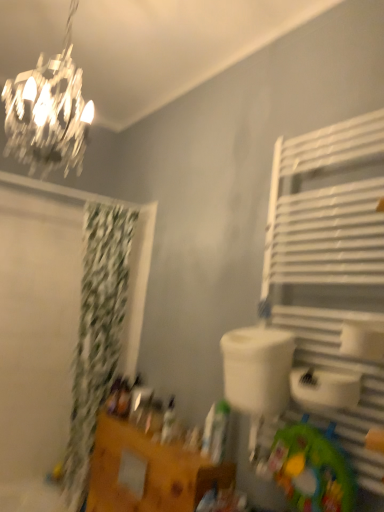
Question: Does point (281, 394) appear closer or farther from the camera than point (84, 436)?

Choices:
 (A) farther
 (B) closer

Answer: (B)

Question: Looking at their shapes, would you say white plastic sink at center is wider or thinner than green fabric shower curtain at left?

Choices:
 (A) wide
 (B) thin

Answer: (B)

Question: Estimate the real-world distances between objects in this image. Which object is closer to the wooden vanity at lower left?

Choices:
 (A) green fabric shower curtain at left
 (B) white plastic sink at center
 (C) green fabric mat at lower right
 (D) white metal towel rack at right
 (E) shiny crystal chandelier at upper left

Answer: (A)

Question: Considering the real-world distances, which object is farthest from the green fabric shower curtain at left?

Choices:
 (A) wooden vanity at lower left
 (B) green fabric mat at lower right
 (C) white plastic sink at center
 (D) white metal towel rack at right
 (E) shiny crystal chandelier at upper left

Answer: (B)